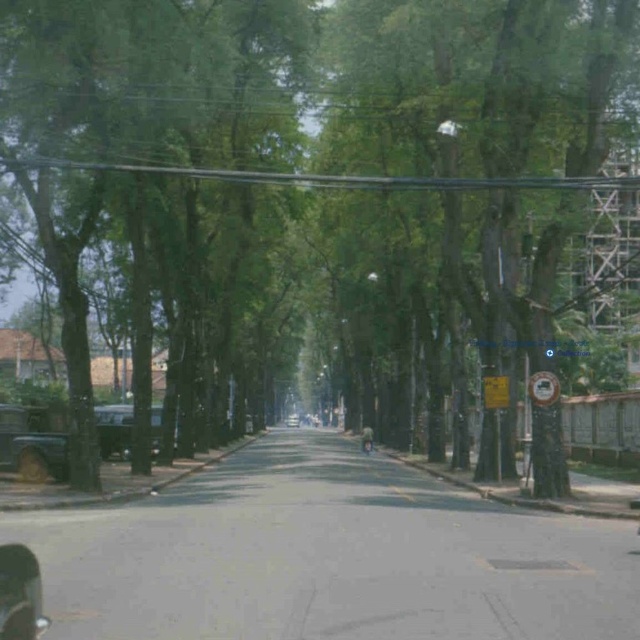
Question: Which point appears farthest from the camera in this image?

Choices:
 (A) (48, 444)
 (B) (451, 180)
 (C) (288, 420)
 (D) (80, 141)

Answer: (C)

Question: Does metallic gray car at left come behind metallic silver car at center?

Choices:
 (A) yes
 (B) no

Answer: (B)

Question: Is the position of metallic wire at upper center more distant than that of metallic gray car at left?

Choices:
 (A) no
 (B) yes

Answer: (A)

Question: Does shiny black car at lower left lie behind metallic silver car at center?

Choices:
 (A) no
 (B) yes

Answer: (A)

Question: Which point is farther to the camera?

Choices:
 (A) (200, 173)
 (B) (236, 291)

Answer: (B)

Question: Based on their relative distances, which object is farther from the green leafy tree at left?

Choices:
 (A) shiny black car at lower left
 (B) metallic silver car at center
 (C) metallic silver car at left
 (D) metallic wire at upper center

Answer: (B)